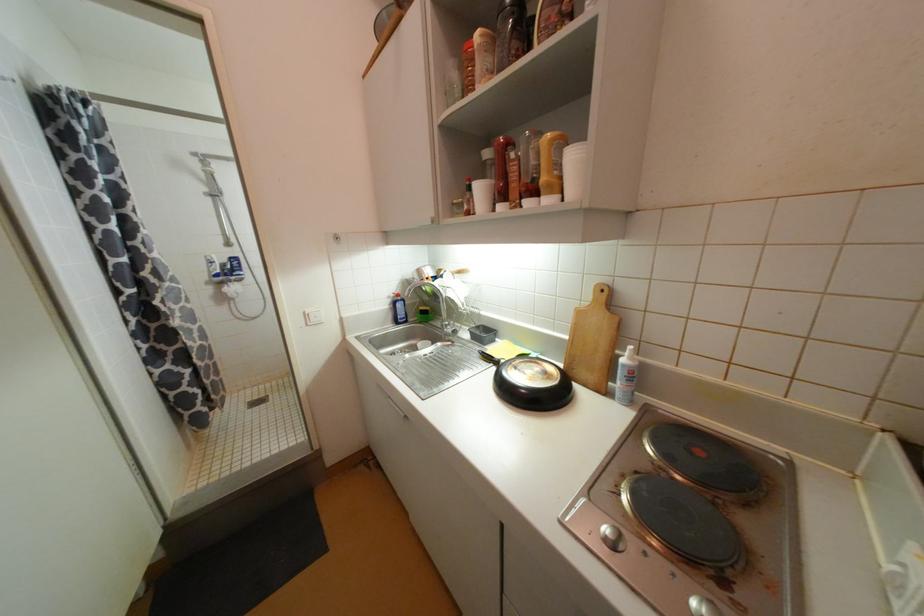
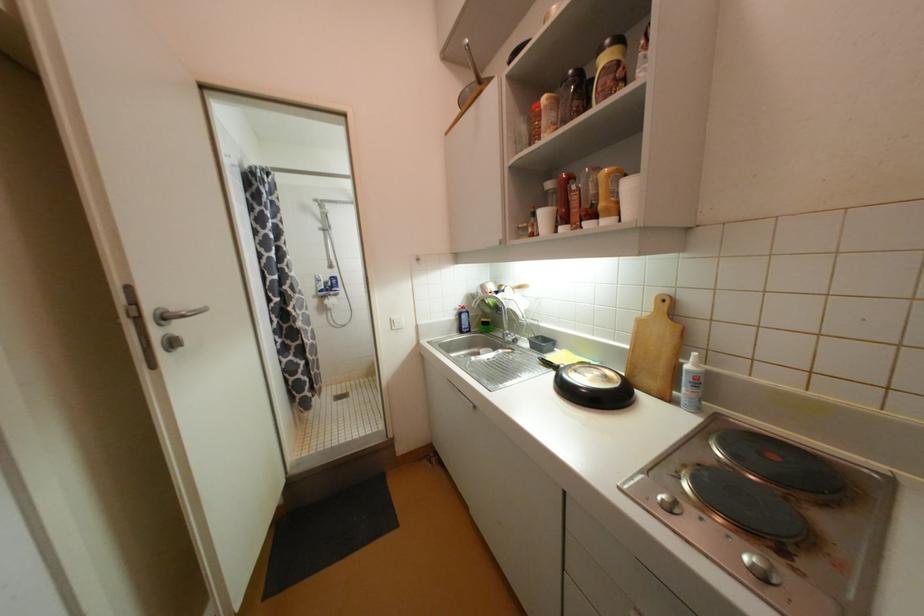
Locate, in the second image, the point that corresponds to [541,193] in the first image.

(600, 217)